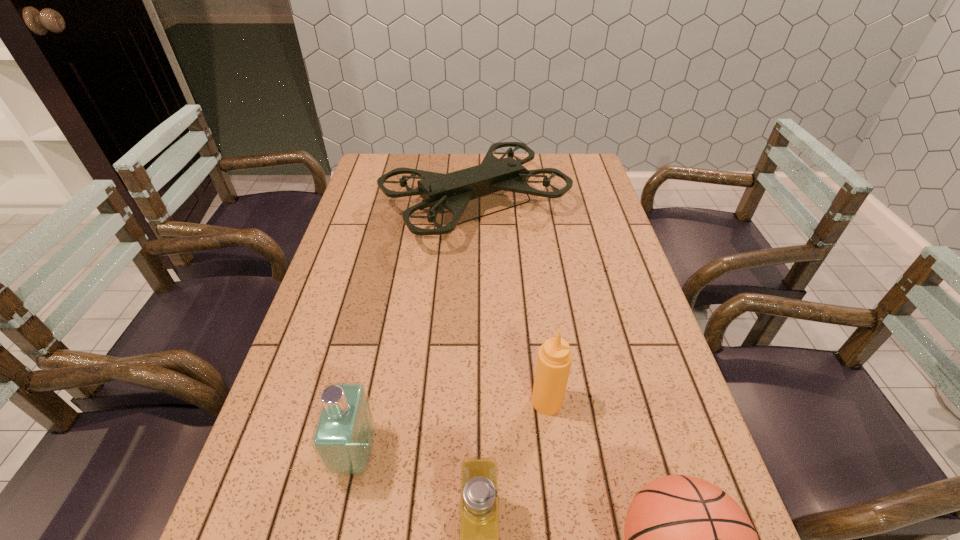
In order to click on the farthest object in this screenshot , I will do `click(452, 191)`.

Identify the location of the tallest object. (452, 191).

Find the location of a particular element. This screenshot has width=960, height=540. the second farthest object is located at coordinates (554, 360).

Where is `the third nearest object`? the third nearest object is located at coordinates (343, 438).

In order to click on the left perfume in this screenshot , I will do `click(343, 438)`.

Where is `vacant space positioned 0.370m on the front of the drone`? vacant space positioned 0.370m on the front of the drone is located at coordinates (473, 365).

At what (x,y) coordinates should I click in order to perform the action: click on free space located on the back of the condiment. Please return your answer as a coordinate pair (x, y). Image resolution: width=960 pixels, height=540 pixels. Looking at the image, I should click on (534, 296).

This screenshot has width=960, height=540. What are the coordinates of `free space located 0.050m on the front label of the third nearest object` in the screenshot? It's located at (400, 454).

Find the location of `object present at the far edge`. object present at the far edge is located at coordinates (452, 191).

Where is `drone located in the left edge section of the desktop`? drone located in the left edge section of the desktop is located at coordinates (452, 191).